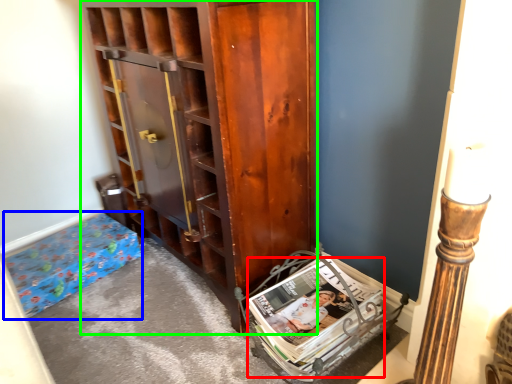
Question: Which object is positioned farthest from magazine (highlighted by a red box)? Select from furniture (highlighted by a blue box) and cabinetry (highlighted by a green box).

Choices:
 (A) furniture
 (B) cabinetry

Answer: (A)